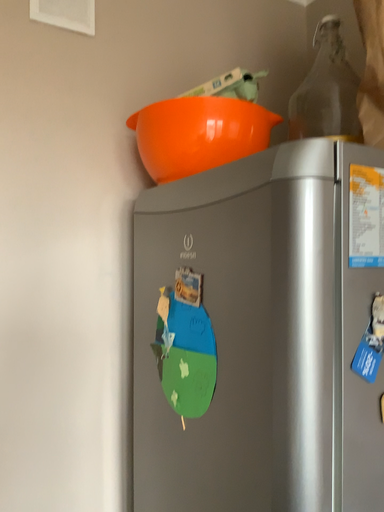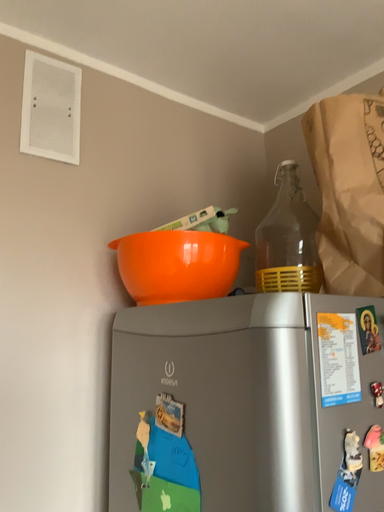
Question: Which way did the camera rotate in the video?

Choices:
 (A) rotated upward
 (B) rotated downward

Answer: (A)